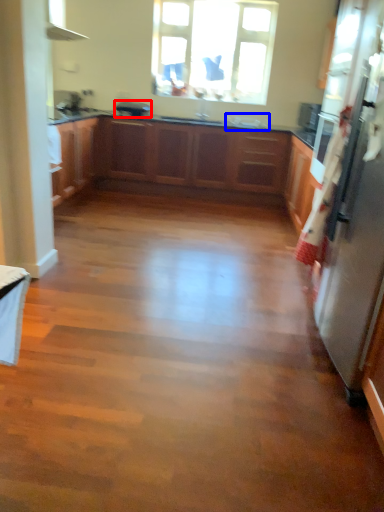
Question: Which point is further to the camera, appliance (highlighted by a red box) or sink (highlighted by a blue box)?

Choices:
 (A) appliance
 (B) sink

Answer: (A)